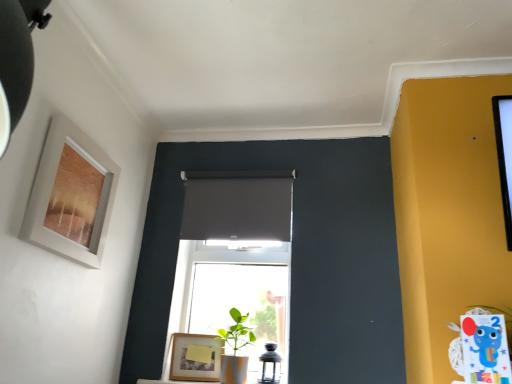
What do you see at coordinates (498, 313) in the screenshot?
I see `green matte plant at center` at bounding box center [498, 313].

This screenshot has height=384, width=512. What do you see at coordinates (195, 357) in the screenshot?
I see `wooden frame at lower center, which appears as the 2th picture frame when viewed from the top` at bounding box center [195, 357].

The width and height of the screenshot is (512, 384). Identify the location of green matte plant pot at center. (234, 349).

Identify the location of green matte plant at center. This screenshot has width=512, height=384. (498, 313).

Which is farther, (248,327) or (287,207)?

Point (287,207)

Between green matte plant pot at center and matte gray curtain at center, which one has smaller width?

Result: Thinner between the two is matte gray curtain at center.

Is green matte plant pot at center to the left or to the right of matte gray curtain at center in the image?

green matte plant pot at center is positioned on matte gray curtain at center's right side.

How many degrees apart are the facing directions of green matte plant pot at center and matte gray curtain at center?

The angular difference between green matte plant pot at center and matte gray curtain at center is 0.000154 degrees.

Is transparent glass lantern at center situated inside matte gray curtain at center or outside?

transparent glass lantern at center is not inside matte gray curtain at center, it's outside.

From a real-world perspective, is transparent glass lantern at center above or below matte gray curtain at center?

In terms of real-world spatial position, transparent glass lantern at center is below matte gray curtain at center.

What's the angular difference between transparent glass lantern at center and matte gray curtain at center's facing directions?

2.77e-05 degrees separate the facing orientations of transparent glass lantern at center and matte gray curtain at center.

Consider the image. Is matte gray curtain at center at the back of transparent glass lantern at center?

No, transparent glass lantern at center is not facing away from matte gray curtain at center.

Are matte gray curtain at center and transparent glass lantern at center making contact?

No, matte gray curtain at center is not in contact with transparent glass lantern at center.

How much distance is there between matte gray curtain at center and transparent glass lantern at center?

matte gray curtain at center and transparent glass lantern at center are 28.83 inches apart.

Between matte gray curtain at center and transparent glass lantern at center, which one has more height?

matte gray curtain at center is taller.

Would you say matte gray curtain at center is outside transparent glass lantern at center?

Absolutely, matte gray curtain at center is external to transparent glass lantern at center.

Is matte white picture frame at upper left, which ranks as the first picture frame in left-to-right order, facing towards green matte plant pot at center?

No, matte white picture frame at upper left, which ranks as the first picture frame in left-to-right order, does not turn towards green matte plant pot at center.

Is the position of matte white picture frame at upper left, which ranks as the first picture frame in left-to-right order, less distant than that of green matte plant pot at center?

Yes, the depth of matte white picture frame at upper left, which ranks as the first picture frame in left-to-right order, is less than that of green matte plant pot at center.

Considering the sizes of objects matte white picture frame at upper left, acting as the first picture frame starting from the front, and green matte plant pot at center in the image provided, who is taller, matte white picture frame at upper left, acting as the first picture frame starting from the front, or green matte plant pot at center?

matte white picture frame at upper left, acting as the first picture frame starting from the front.

From a real-world perspective, is green matte plant pot at center positioned above or below green matte plant at center?

Clearly, from a real-world perspective, green matte plant pot at center is below green matte plant at center.

Between green matte plant pot at center and green matte plant at center, which one is positioned in front?

green matte plant at center is closer to the camera.

Which is more to the right, green matte plant pot at center or green matte plant at center?

From the viewer's perspective, green matte plant at center appears more on the right side.

Is green matte plant pot at center oriented away from green matte plant at center?

No, green matte plant pot at center is not facing the opposite direction of green matte plant at center.

In the scene shown: From the image's perspective, who appears lower, transparent glass lantern at center or green matte plant at center?

transparent glass lantern at center appears lower in the image.

Does point (275, 343) come farther from viewer compared to point (470, 306)?

Yes, it is.

Between transparent glass lantern at center and green matte plant at center, which one has larger size?

transparent glass lantern at center is bigger.

From a real-world perspective, is transparent glass lantern at center physically below green matte plant at center?

Indeed, from a real-world perspective, transparent glass lantern at center is positioned beneath green matte plant at center.

Can you confirm if green matte plant pot at center is positioned to the right of matte white picture frame at upper left, the 2th picture frame in the bottom-to-top sequence?

Indeed, green matte plant pot at center is positioned on the right side of matte white picture frame at upper left, the 2th picture frame in the bottom-to-top sequence.

Considering the points (220, 377) and (33, 226), which point is behind, point (220, 377) or point (33, 226)?

The point (220, 377) is farther from the camera.

Based on the photo, from the image's perspective, is green matte plant pot at center located above or below matte white picture frame at upper left, which ranks as the 1th picture frame in top-to-bottom order?

green matte plant pot at center is below matte white picture frame at upper left, which ranks as the 1th picture frame in top-to-bottom order.

Is green matte plant pot at center positioned with its back to matte white picture frame at upper left, which ranks as the 1th picture frame in top-to-bottom order?

No, green matte plant pot at center's orientation is not away from matte white picture frame at upper left, which ranks as the 1th picture frame in top-to-bottom order.

Identify the location of houseplant below the matte gray curtain at center (from a real-world perspective). The image size is (512, 384). (234, 349).

In order to click on curtain located above the transparent glass lantern at center (from the image's perspective) in this screenshot , I will do `click(237, 205)`.

When comparing their distances from transparent glass lantern at center, does matte gray curtain at center or wooden frame at lower center, which is the 2th picture frame in front-to-back order, seem closer?

wooden frame at lower center, which is the 2th picture frame in front-to-back order.

Looking at the image, which one is located closer to matte white picture frame at upper left, acting as the first picture frame starting from the front, matte gray curtain at center or transparent glass lantern at center?

matte gray curtain at center lies closer to matte white picture frame at upper left, acting as the first picture frame starting from the front, than the other object.

When comparing their distances from matte gray curtain at center, does matte white picture frame at upper left, the 2th picture frame in the bottom-to-top sequence, or green matte plant at center seem closer?

matte white picture frame at upper left, the 2th picture frame in the bottom-to-top sequence, is positioned closer to the anchor matte gray curtain at center.

Considering their positions, is transparent glass lantern at center positioned closer to green matte plant at center than matte white picture frame at upper left, acting as the first picture frame starting from the front?

transparent glass lantern at center lies closer to green matte plant at center than the other object.

Based on their spatial positions, is wooden frame at lower center, which is the 2th picture frame in front-to-back order, or green matte plant at center closer to transparent glass lantern at center?

wooden frame at lower center, which is the 2th picture frame in front-to-back order.

Considering their positions, is transparent glass lantern at center positioned closer to matte gray curtain at center than wooden frame at lower center, marked as the 1th picture frame in a bottom-to-top arrangement?

wooden frame at lower center, marked as the 1th picture frame in a bottom-to-top arrangement.

From the image, which object appears to be farther from transparent glass lantern at center, wooden frame at lower center, which appears as the first picture frame when viewed from the back, or matte gray curtain at center?

The object further to transparent glass lantern at center is matte gray curtain at center.

Looking at the image, which one is located further to matte white picture frame at upper left, acting as the first picture frame starting from the front, green matte plant at center or transparent glass lantern at center?

green matte plant at center is further to matte white picture frame at upper left, acting as the first picture frame starting from the front.

The image size is (512, 384). What are the coordinates of `picture frame between matte white picture frame at upper left, which ranks as the 1th picture frame in top-to-bottom order, and green matte plant at center` in the screenshot? It's located at (195, 357).

Locate an element on the screen. This screenshot has width=512, height=384. houseplant between matte gray curtain at center and transparent glass lantern at center vertically is located at coordinates (234, 349).

Locate an element on the screen. This screenshot has height=384, width=512. curtain between matte white picture frame at upper left, which ranks as the first picture frame in left-to-right order, and transparent glass lantern at center vertically is located at coordinates (237, 205).

What are the coordinates of `table lamp between wooden frame at lower center, which is counted as the first picture frame, starting from the right, and green matte plant at center, in the horizontal direction` in the screenshot? It's located at (270, 365).